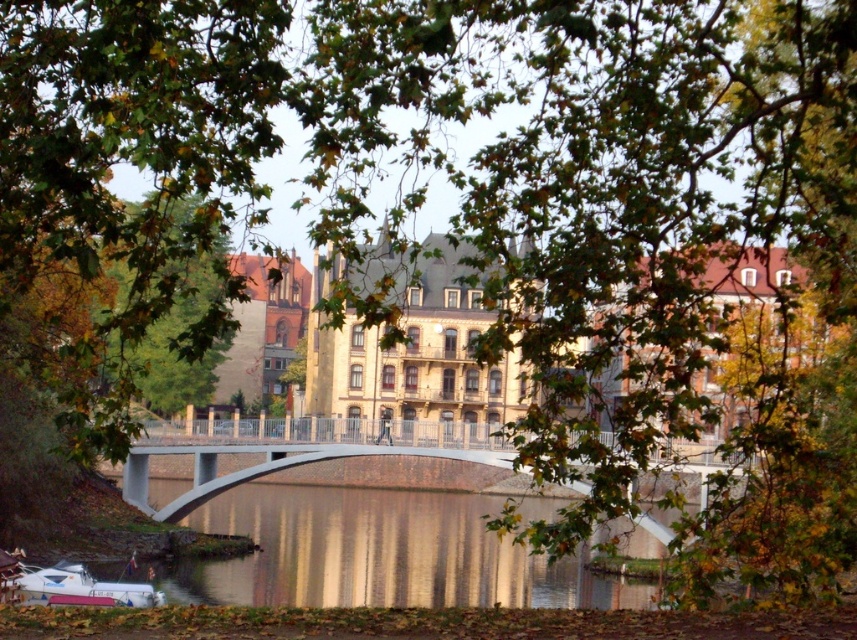
Question: Is glossy reflective water at center thinner than concrete bridge at center?

Choices:
 (A) yes
 (B) no

Answer: (A)

Question: Which of these objects is positioned farthest from the concrete bridge at center?

Choices:
 (A) glossy reflective water at center
 (B) white glossy boat at lower left

Answer: (B)

Question: Among these objects, which one is farthest from the camera?

Choices:
 (A) white glossy boat at lower left
 (B) glossy reflective water at center
 (C) concrete bridge at center

Answer: (B)

Question: Is glossy reflective water at center to the right of white glossy boat at lower left from the viewer's perspective?

Choices:
 (A) no
 (B) yes

Answer: (B)

Question: Which point is closer to the camera?

Choices:
 (A) (142, 460)
 (B) (94, 582)

Answer: (B)

Question: Does glossy reflective water at center have a larger size compared to concrete bridge at center?

Choices:
 (A) no
 (B) yes

Answer: (A)